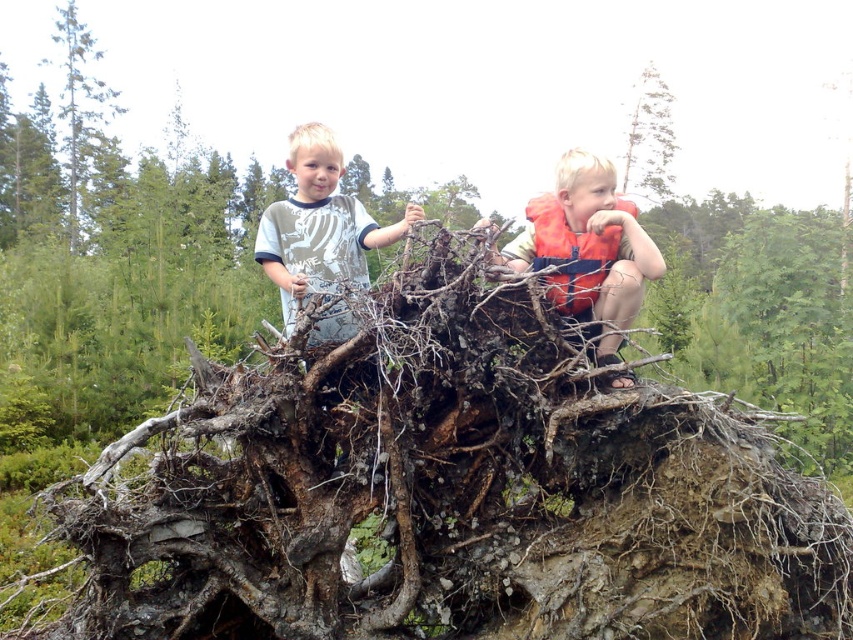
You are a hiker who wants to take a shortcut through the forest. You see the brown rough tree roots at center and the green rough bark tree at upper left. Which object is nearer to you as you decide your path?

The brown rough tree roots at center are closer to the viewer than the green rough bark tree at upper left, so the brown rough tree roots at center would be nearer to you as you decide your path.

You are a hiker who needs to retrieve an item from the smooth bark tree at upper right while staying near the orange life vest at center. Can you reach the tree without moving more than 25 meters from the vest?

The orange life vest at center and smooth bark tree at upper right are 25.35 meters apart. Since the distance exceeds 25 meters, you cannot reach the tree without moving more than 25 meters from the vest.